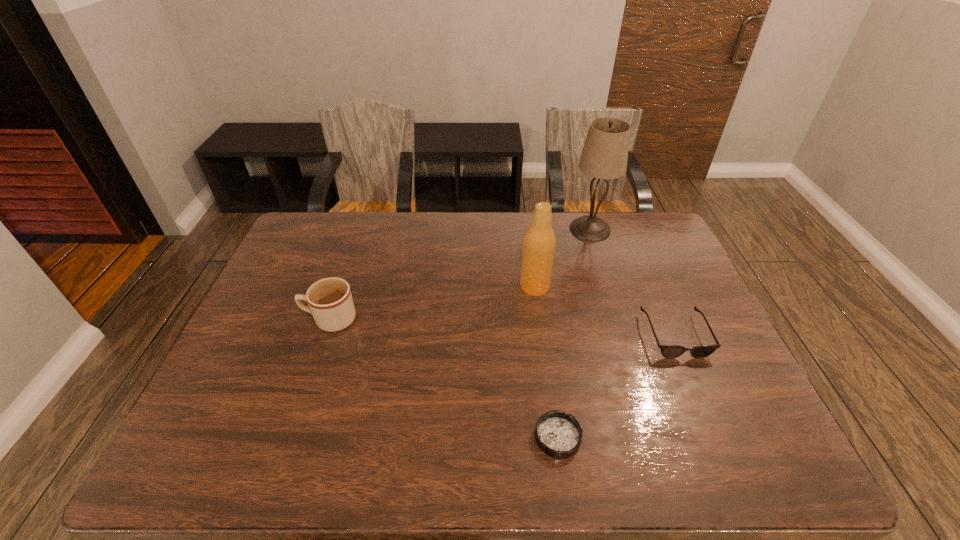
I want to click on free space between the leftmost object and the fourth shortest object, so click(x=432, y=303).

Where is `free space between the lampshade and the beer bottle`? The image size is (960, 540). free space between the lampshade and the beer bottle is located at coordinates (563, 258).

The image size is (960, 540). Identify the location of vacant area that lies between the lampshade and the shortest object. (574, 333).

Identify the location of vacant space that's between the beer bottle and the ashtray. (546, 362).

Where is `the closest object to the second farthest object`? This screenshot has height=540, width=960. the closest object to the second farthest object is located at coordinates (604, 156).

Find the location of a particular element. object identified as the fourth closest to the leftmost object is located at coordinates (668, 351).

The height and width of the screenshot is (540, 960). I want to click on free space that satisfies the following two spatial constraints: 1. on the side of the mug with the handle; 2. on the back side of the second farthest object, so click(342, 287).

This screenshot has height=540, width=960. In order to click on free space that satisfies the following two spatial constraints: 1. on the side of the second tallest object with the handle; 2. on the left side of the leftmost object in this screenshot , I will do `click(342, 287)`.